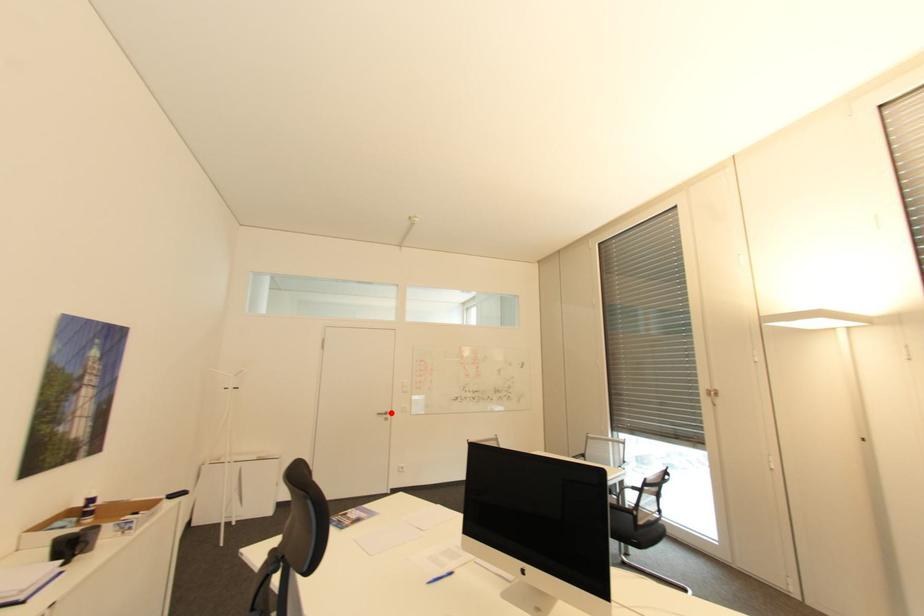
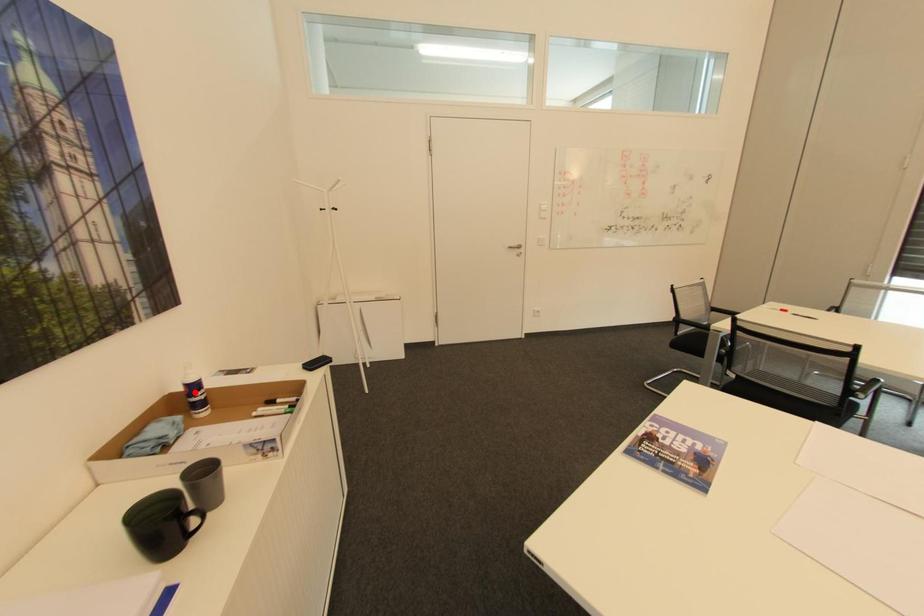
I am providing you with two images of the same scene from different viewpoints. A red point is marked on the first image and another point is marked on the second image. Are the points marked in image1 and image2 representing the same 3D position?

No